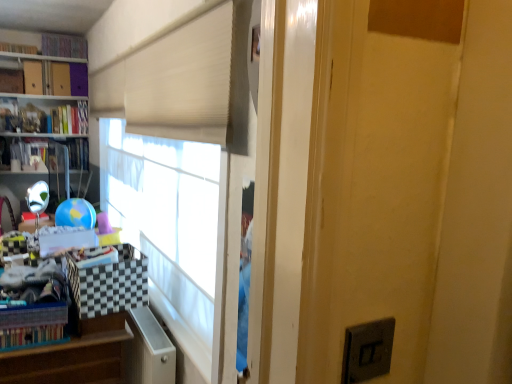
Question: Are wooden at left and hardcover book at upper left, the third book positioned from the bottom, beside each other?

Choices:
 (A) no
 (B) yes

Answer: (A)

Question: Would you say wooden at left is a long distance from hardcover book at upper left, which is the 2th book from top to bottom?

Choices:
 (A) yes
 (B) no

Answer: (A)

Question: Is wooden at left to the left of hardcover book at upper left, which is the 2th book from top to bottom, from the viewer's perspective?

Choices:
 (A) yes
 (B) no

Answer: (B)

Question: Is wooden at left outside of hardcover book at upper left, the third book positioned from the bottom?

Choices:
 (A) no
 (B) yes

Answer: (B)

Question: Considering the relative sizes of wooden at left and hardcover book at upper left, which is the 2th book from top to bottom, in the image provided, is wooden at left smaller than hardcover book at upper left, which is the 2th book from top to bottom,?

Choices:
 (A) no
 (B) yes

Answer: (A)

Question: From the image's perspective, does wooden at left appear higher than hardcover book at upper left, which is the 2th book from top to bottom?

Choices:
 (A) yes
 (B) no

Answer: (B)

Question: Is hardcover book at left, the 1th book from the bottom, turned away from white plastic file cabinet at lower left?

Choices:
 (A) no
 (B) yes

Answer: (A)

Question: Can you confirm if hardcover book at left, which is counted as the fourth book, starting from the top, is smaller than white plastic file cabinet at lower left?

Choices:
 (A) yes
 (B) no

Answer: (B)

Question: Is hardcover book at left, the 1th book from the bottom, at the right side of white plastic file cabinet at lower left?

Choices:
 (A) yes
 (B) no

Answer: (B)

Question: Is hardcover book at left, which is counted as the fourth book, starting from the top, oriented towards white plastic file cabinet at lower left?

Choices:
 (A) no
 (B) yes

Answer: (B)

Question: From a real-world perspective, is hardcover book at left, the 1th book from the bottom, physically below white plastic file cabinet at lower left?

Choices:
 (A) no
 (B) yes

Answer: (A)

Question: Considering the relative sizes of hardcover book at left, the 1th book from the bottom, and white plastic file cabinet at lower left in the image provided, is hardcover book at left, the 1th book from the bottom, taller than white plastic file cabinet at lower left?

Choices:
 (A) no
 (B) yes

Answer: (A)

Question: Could you tell me if wooden at left is turned towards hardcover book at left, which is counted as the fourth book, starting from the top?

Choices:
 (A) yes
 (B) no

Answer: (B)